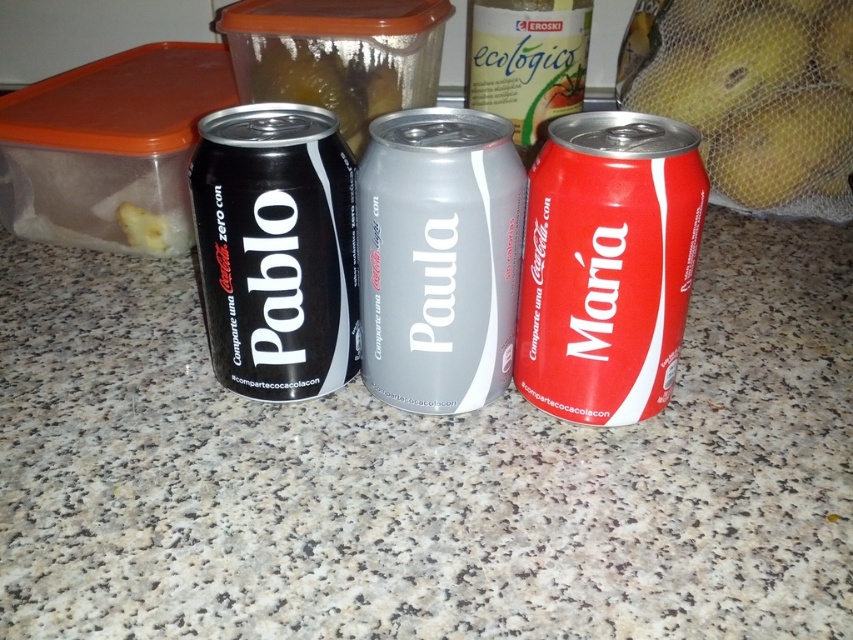
Question: Which point is closer to the camera?

Choices:
 (A) satin silver can at center
 (B) red matte can at center
 (C) red matte coca-cola can at right

Answer: (C)

Question: Which point appears farthest from the camera in this image?

Choices:
 (A) (415, 122)
 (B) (665, 349)
 (C) (701, 45)

Answer: (C)

Question: From the image, what is the correct spatial relationship of red matte coca-cola can at right in relation to red matte can at center?

Choices:
 (A) above
 (B) below

Answer: (B)

Question: Does satin silver can at center have a smaller size compared to yellow mesh bag at right?

Choices:
 (A) yes
 (B) no

Answer: (A)

Question: Does red matte coca-cola can at right lie behind red matte can at center?

Choices:
 (A) no
 (B) yes

Answer: (A)

Question: Which of the following is the farthest from the observer?

Choices:
 (A) red matte can at center
 (B) red matte coca-cola can at right

Answer: (A)